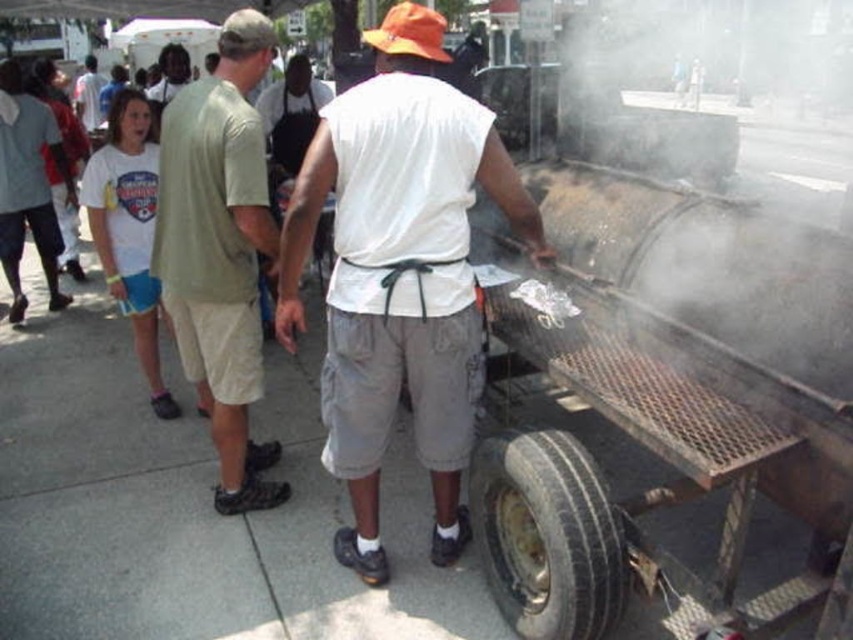
Is white matte shirt at center above black rubber tire at lower right?

Yes.

Between white matte shirt at center and black rubber tire at lower right, which one appears on the right side from the viewer's perspective?

black rubber tire at lower right is more to the right.

Who is more distant from viewer, (425, 186) or (552, 630)?

The point (425, 186) is more distant.

Image resolution: width=853 pixels, height=640 pixels. Find the location of `white matte shirt at center`. white matte shirt at center is located at coordinates (399, 284).

Can you confirm if black rubber tire at lower right is taller than matte black shirt at center?

Correct, black rubber tire at lower right is much taller as matte black shirt at center.

In the scene shown: Does black rubber tire at lower right have a larger size compared to matte black shirt at center?

Actually, black rubber tire at lower right might be smaller than matte black shirt at center.

Is point (503, 556) closer to viewer compared to point (177, 61)?

Yes, point (503, 556) is in front of point (177, 61).

Find the location of a particular element. This screenshot has width=853, height=640. black rubber tire at lower right is located at coordinates (547, 534).

Can you confirm if light green cotton shirt at center is positioned to the right of black rubber tire at lower right?

Incorrect, light green cotton shirt at center is not on the right side of black rubber tire at lower right.

Where is `light green cotton shirt at center`? The height and width of the screenshot is (640, 853). light green cotton shirt at center is located at coordinates (219, 250).